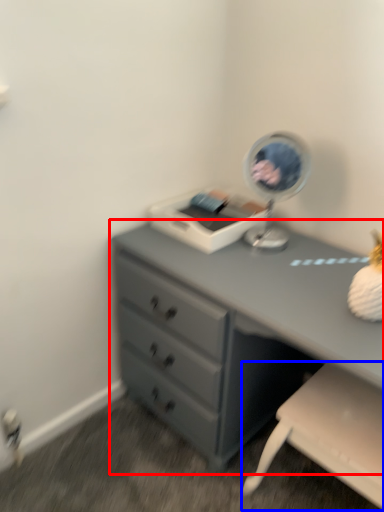
Question: Which object is further to the camera taking this photo, chest of drawers (highlighted by a red box) or swivel chair (highlighted by a blue box)?

Choices:
 (A) chest of drawers
 (B) swivel chair

Answer: (B)